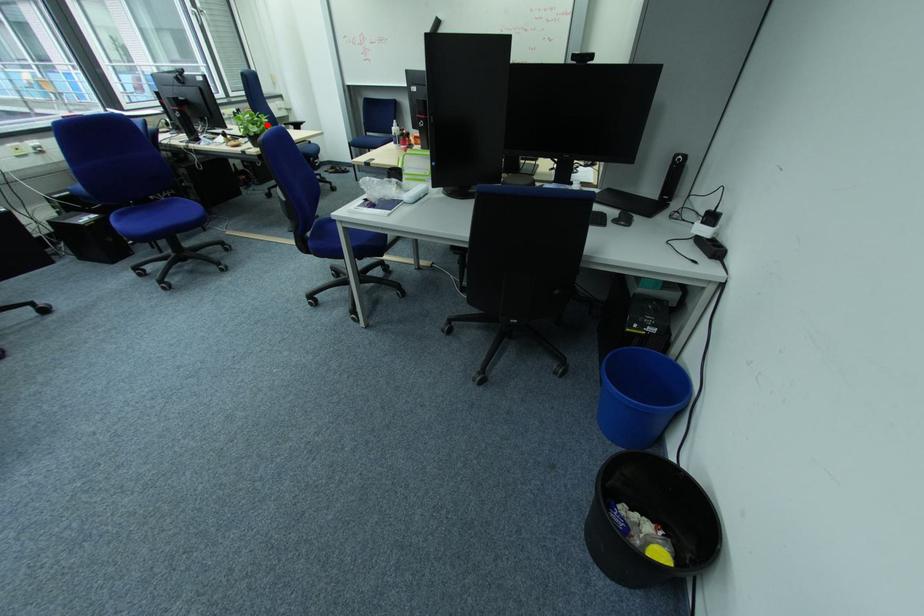
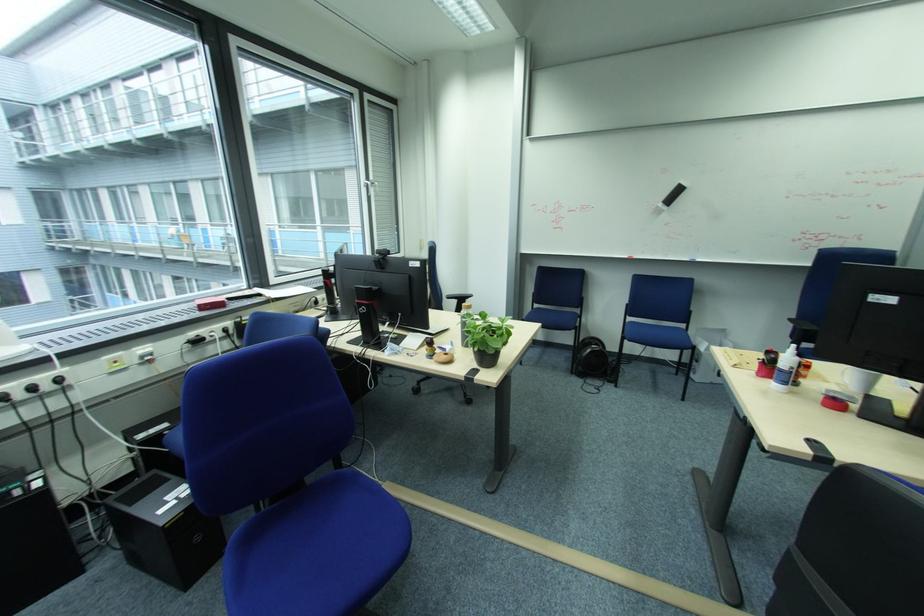
In the second image, find the point that corresponds to the highlighted location in the first image.

(508, 333)